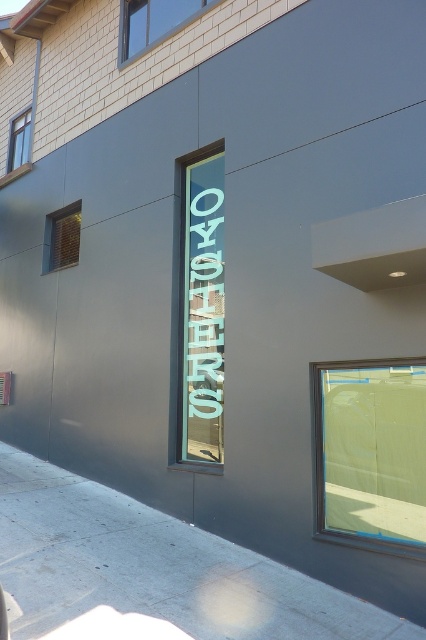
Question: Which is nearer to the clear glass window at center?

Choices:
 (A) green glass sign at center
 (B) gray concrete sidewalk at lower left
 (C) clear glass window at upper left
 (D) white glass window at upper center

Answer: (B)

Question: Among these objects, which one is farthest from the camera?

Choices:
 (A) green glass sign at center
 (B) clear glass window at upper left
 (C) white glass window at upper center
 (D) gray concrete sidewalk at lower left

Answer: (B)

Question: Does clear glass window at upper left appear on the left side of wooden window at upper left?

Choices:
 (A) no
 (B) yes

Answer: (A)

Question: Estimate the real-world distances between objects in this image. Which object is closer to the white glass window at upper center?

Choices:
 (A) clear glass window at upper left
 (B) clear glass window at center
 (C) green glass sign at center

Answer: (A)

Question: Does gray concrete sidewalk at lower left appear under clear glass window at center?

Choices:
 (A) no
 (B) yes

Answer: (B)

Question: Where is white glass window at upper center located in relation to clear glass window at upper left in the image?

Choices:
 (A) above
 (B) below

Answer: (A)